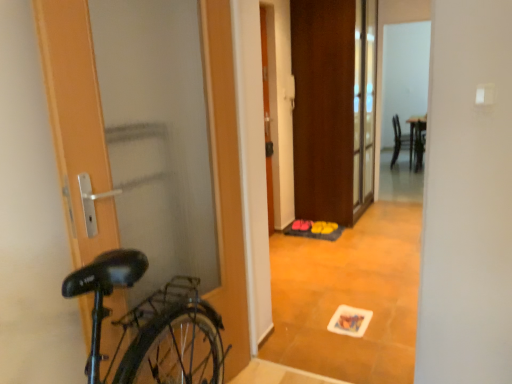
Describe the element at coordinates (353, 289) in the screenshot. I see `wooden floor mat at center` at that location.

Find the location of a particular element. wooden door at left, arranged as the third door when viewed from the right is located at coordinates (76, 116).

What is the approximate height of matte black chair at upper right?

It is 79.23 centimeters.

At what (x,y) coordinates should I click in order to perform the action: click on brown matte door at center, positioned as the first door in right-to-left order. Please return your answer as a coordinate pair (x, y). This screenshot has height=384, width=512. Looking at the image, I should click on (333, 107).

From a real-world perspective, between orange matte door at center, the 2th door positioned from the back, and yellow rubber doormat at center, who is vertically higher?

orange matte door at center, the 2th door positioned from the back.

Is there a large distance between orange matte door at center, which is the second door in front-to-back order, and yellow rubber doormat at center?

No, orange matte door at center, which is the second door in front-to-back order, is not far from yellow rubber doormat at center.

Considering the positions of point (266, 178) and point (317, 234), is point (266, 178) closer or farther from the camera than point (317, 234)?

Clearly, point (266, 178) is closer to the camera than point (317, 234).

Locate an element on the screen. This screenshot has width=512, height=384. doormat behind the orange matte door at center, the 2th door positioned from the right is located at coordinates (318, 232).

From the image's perspective, is matte black chair at upper right located above or below orange matte door at center, the 2th door positioned from the back?

matte black chair at upper right is situated higher than orange matte door at center, the 2th door positioned from the back, in the image.

Between point (394, 128) and point (263, 20), which one is positioned in front?

The point (263, 20) is closer.

Who is taller, matte black chair at upper right or orange matte door at center, the 2th door positioned from the back?

orange matte door at center, the 2th door positioned from the back, is taller.

Which is more to the left, matte black chair at upper right or orange matte door at center, the 2th door positioned from the back?

From the viewer's perspective, orange matte door at center, the 2th door positioned from the back, appears more on the left side.

Which of these two, orange matte door at center, acting as the 2th door starting from the left, or wooden floor mat at center, stands taller?

orange matte door at center, acting as the 2th door starting from the left.

From a real-world perspective, which is physically below, orange matte door at center, the 2th door positioned from the right, or wooden floor mat at center?

From a 3D spatial view, wooden floor mat at center is below.

This screenshot has width=512, height=384. What are the coordinates of `corridor that appears below the orange matte door at center, acting as the 2th door starting from the left (from a real-world perspective)` in the screenshot? It's located at (353, 289).

Considering the relative sizes of orange matte door at center, the 2th door positioned from the back, and wooden floor mat at center in the image provided, is orange matte door at center, the 2th door positioned from the back, wider than wooden floor mat at center?

Incorrect, the width of orange matte door at center, the 2th door positioned from the back, does not surpass that of wooden floor mat at center.

Is matte black chair at upper right far from yellow rubber doormat at center?

Absolutely, matte black chair at upper right is distant from yellow rubber doormat at center.

In terms of height, does matte black chair at upper right look taller or shorter compared to yellow rubber doormat at center?

matte black chair at upper right is taller than yellow rubber doormat at center.

From the image's perspective, is matte black chair at upper right under yellow rubber doormat at center?

Incorrect, from the image's perspective, matte black chair at upper right is higher than yellow rubber doormat at center.

Which object is thinner, yellow rubber doormat at center or wooden door at left, arranged as the third door when viewed from the right?

yellow rubber doormat at center is thinner.

Does yellow rubber doormat at center have a larger size compared to wooden door at left, the third door when ordered from back to front?

Incorrect, yellow rubber doormat at center is not larger than wooden door at left, the third door when ordered from back to front.

Would you say yellow rubber doormat at center is a long distance from wooden door at left, arranged as the third door when viewed from the right?

Indeed, yellow rubber doormat at center is not near wooden door at left, arranged as the third door when viewed from the right.

This screenshot has width=512, height=384. In order to click on doormat that is above the wooden door at left, marked as the first door in a front-to-back arrangement (from the image's perspective) in this screenshot , I will do `click(318, 232)`.

Can you tell me how much orange matte door at center, the 2th door positioned from the right, and matte black chair at upper right differ in facing direction?

The angle between the facing direction of orange matte door at center, the 2th door positioned from the right, and the facing direction of matte black chair at upper right is 0.937 degrees.

Is orange matte door at center, acting as the 2th door starting from the left, to the left of matte black chair at upper right from the viewer's perspective?

Indeed, orange matte door at center, acting as the 2th door starting from the left, is positioned on the left side of matte black chair at upper right.

Considering the sizes of orange matte door at center, acting as the 2th door starting from the left, and matte black chair at upper right in the image, is orange matte door at center, acting as the 2th door starting from the left, taller or shorter than matte black chair at upper right?

orange matte door at center, acting as the 2th door starting from the left, is taller than matte black chair at upper right.

Considering the relative sizes of yellow rubber doormat at center and orange matte door at center, which is the second door in front-to-back order, in the image provided, is yellow rubber doormat at center taller than orange matte door at center, which is the second door in front-to-back order,?

In fact, yellow rubber doormat at center may be shorter than orange matte door at center, which is the second door in front-to-back order.

Which is in front, yellow rubber doormat at center or orange matte door at center, acting as the 2th door starting from the left?

orange matte door at center, acting as the 2th door starting from the left, is closer to the camera.

Considering the points (329, 227) and (261, 52), which point is in front, point (329, 227) or point (261, 52)?

The point (261, 52) is in front.

Locate an element on the screen. The image size is (512, 384). door that is the 2nd one when counting forward from the yellow rubber doormat at center is located at coordinates (267, 120).

Where is `chair located above the orange matte door at center, the 2th door positioned from the back (from the image's perspective)`? chair located above the orange matte door at center, the 2th door positioned from the back (from the image's perspective) is located at coordinates (398, 139).

From the image, which object appears to be farther from yellow rubber doormat at center, orange matte door at center, acting as the 2th door starting from the left, or brown matte door at center, positioned as the first door in right-to-left order?

Among the two, brown matte door at center, positioned as the first door in right-to-left order, is located further to yellow rubber doormat at center.

Considering their positions, is wooden door at left, marked as the first door in a front-to-back arrangement, positioned closer to orange matte door at center, the 2th door positioned from the back, than brown matte door at center, acting as the 1th door starting from the back?

brown matte door at center, acting as the 1th door starting from the back.

Looking at this image, based on their spatial positions, is orange matte door at center, which is the second door in front-to-back order, or brown matte door at center, positioned as the first door in right-to-left order, closer to matte black chair at upper right?

Among the two, brown matte door at center, positioned as the first door in right-to-left order, is located nearer to matte black chair at upper right.

Estimate the real-world distances between objects in this image. Which object is further from orange matte door at center, acting as the 2th door starting from the left, wooden door at left, the third door when ordered from back to front, or yellow rubber doormat at center?

wooden door at left, the third door when ordered from back to front, is positioned further to the anchor orange matte door at center, acting as the 2th door starting from the left.

Considering their positions, is yellow rubber doormat at center positioned further to wooden door at left, marked as the first door in a front-to-back arrangement, than matte black chair at upper right?

matte black chair at upper right is further to wooden door at left, marked as the first door in a front-to-back arrangement.

When comparing their distances from matte black chair at upper right, does wooden floor mat at center or yellow rubber doormat at center seem further?

Among the two, yellow rubber doormat at center is located further to matte black chair at upper right.

Estimate the real-world distances between objects in this image. Which object is closer to wooden floor mat at center, matte black chair at upper right or orange matte door at center, the 2th door positioned from the right?

Based on the image, orange matte door at center, the 2th door positioned from the right, appears to be nearer to wooden floor mat at center.

When comparing their distances from orange matte door at center, the 2th door positioned from the back, does wooden floor mat at center or matte black chair at upper right seem further?

The object further to orange matte door at center, the 2th door positioned from the back, is matte black chair at upper right.

Locate an element on the screen. This screenshot has width=512, height=384. doormat positioned between wooden floor mat at center and matte black chair at upper right from near to far is located at coordinates (318, 232).

The width and height of the screenshot is (512, 384). Identify the location of doormat between orange matte door at center, which is the second door in front-to-back order, and matte black chair at upper right, along the z-axis. pos(318,232).

The width and height of the screenshot is (512, 384). Find the location of `doormat located between wooden door at left, the third door when ordered from back to front, and matte black chair at upper right in the depth direction`. doormat located between wooden door at left, the third door when ordered from back to front, and matte black chair at upper right in the depth direction is located at coordinates (318, 232).

Locate an element on the screen. door between brown matte door at center, placed as the 3th door when sorted from left to right, and yellow rubber doormat at center, in the vertical direction is located at coordinates (267, 120).